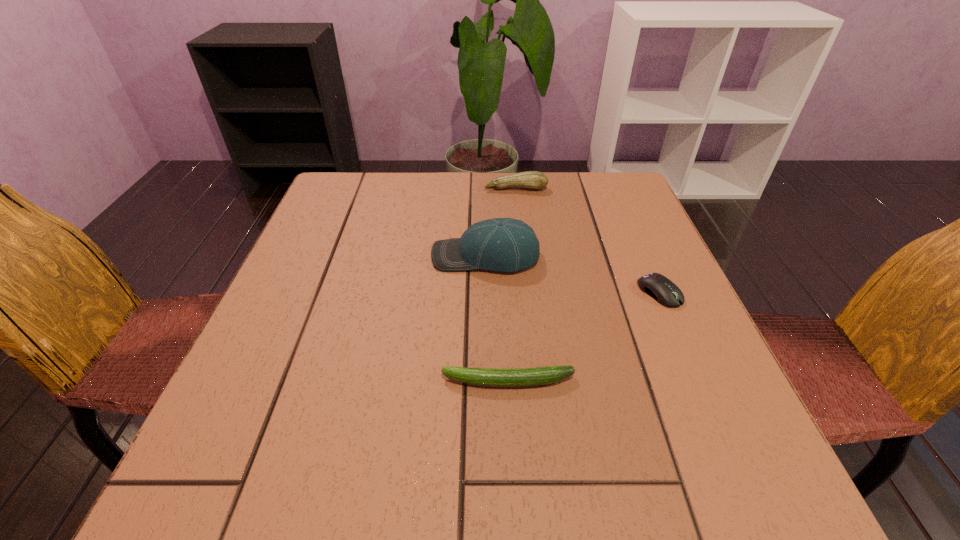
Select which object appears as the closest to the taller zucchini. Please provide its 2D coordinates. Your answer should be formatted as a tuple, i.e. [(x, y)], where the tuple contains the x and y coordinates of a point satisfying the conditions above.

[(509, 245)]

At what (x,y) coordinates should I click in order to perform the action: click on vacant region that satisfies the following two spatial constraints: 1. at the stem end of the farthest object; 2. on the right side of the rightmost object. Please return your answer as a coordinate pair (x, y). The height and width of the screenshot is (540, 960). Looking at the image, I should click on (528, 292).

Where is `free spot that satisfies the following two spatial constraints: 1. at the stem end of the farther zucchini; 2. on the front-facing side of the nearer zucchini`? This screenshot has height=540, width=960. free spot that satisfies the following two spatial constraints: 1. at the stem end of the farther zucchini; 2. on the front-facing side of the nearer zucchini is located at coordinates (538, 381).

Locate an element on the screen. This screenshot has width=960, height=540. vacant point that satisfies the following two spatial constraints: 1. on the front side of the second nearest object; 2. on the front-facing side of the nearer zucchini is located at coordinates (698, 381).

Locate an element on the screen. The height and width of the screenshot is (540, 960). vacant space that satisfies the following two spatial constraints: 1. at the stem end of the rightmost object; 2. on the right side of the taller zucchini is located at coordinates (528, 292).